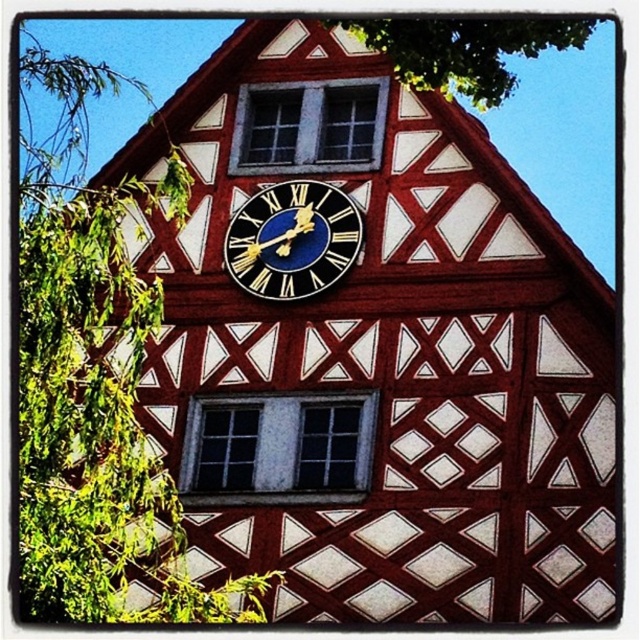
You are a GUI agent. You are given a task and a screenshot of the screen. Output one action in this format:
    pyautogui.click(x=<x>, y=<y>)
    Task: Click on the green leafy tree at upper center
    The width and height of the screenshot is (640, 640).
    Given the screenshot: What is the action you would take?
    click(465, 49)

Who is more forward, (x=550, y=48) or (x=294, y=220)?

Point (x=294, y=220)

You are a GUI agent. You are given a task and a screenshot of the screen. Output one action in this format:
    pyautogui.click(x=<x>, y=<y>)
    Task: Click on the green leafy tree at upper center
    
    Given the screenshot: What is the action you would take?
    pyautogui.click(x=465, y=49)

Does green leafy tree at left appear under blue enamel clock at center?

No, green leafy tree at left is not below blue enamel clock at center.

Which is in front, point (58, 385) or point (275, 243)?

Point (58, 385) is in front.

You are a GUI agent. You are given a task and a screenshot of the screen. Output one action in this format:
    pyautogui.click(x=<x>, y=<y>)
    Task: Click on the green leafy tree at left
    The width and height of the screenshot is (640, 640).
    Given the screenshot: What is the action you would take?
    pyautogui.click(x=93, y=380)

This screenshot has height=640, width=640. I want to click on green leafy tree at left, so click(93, 380).

Is green leafy tree at left shorter than green leafy tree at upper center?

In fact, green leafy tree at left may be taller than green leafy tree at upper center.

Who is more forward, (x=113, y=72) or (x=536, y=29)?

Positioned in front is point (x=536, y=29).

Image resolution: width=640 pixels, height=640 pixels. I want to click on green leafy tree at left, so click(x=93, y=380).